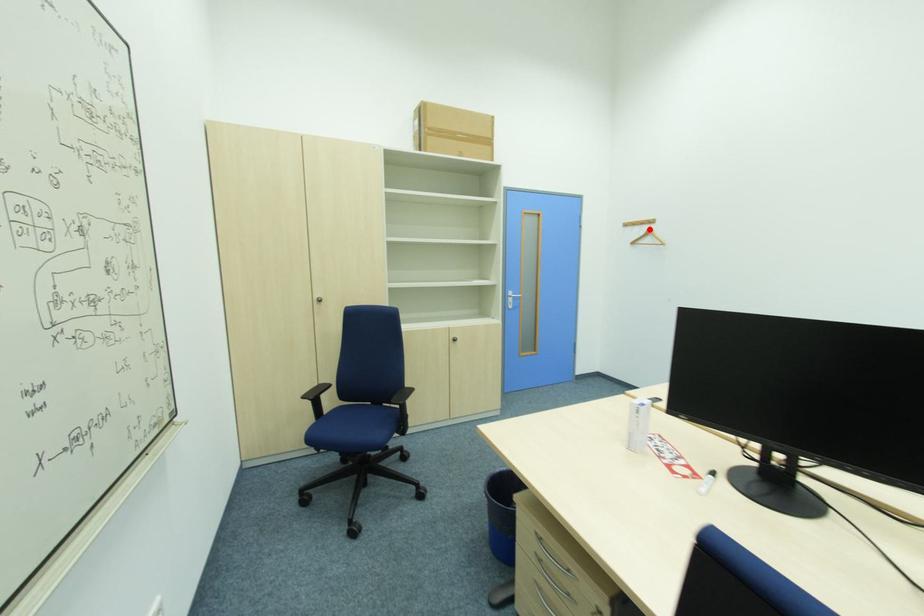
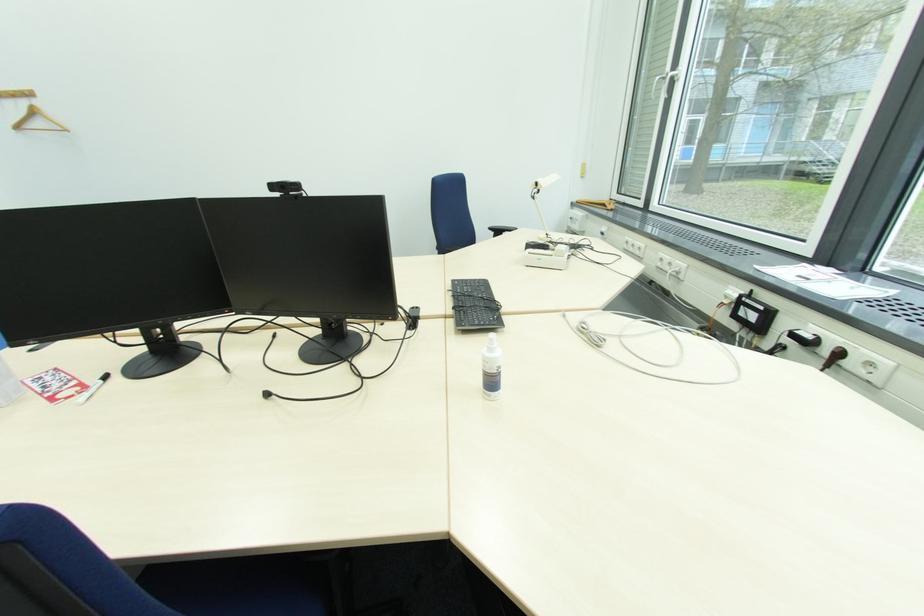
The point at the highlighted location is marked in the first image. Where is the corresponding point in the second image?

(29, 105)